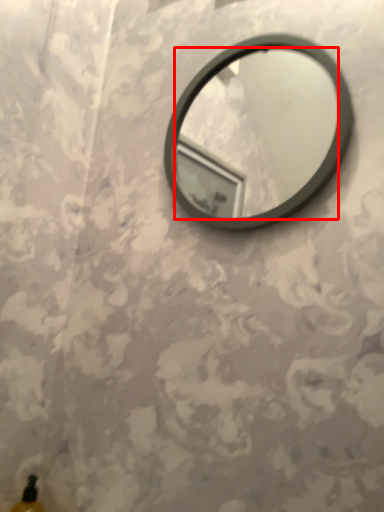
Question: Considering the relative positions of mirror (annotated by the red box) and bottle in the image provided, where is mirror (annotated by the red box) located with respect to the staircase?

Choices:
 (A) left
 (B) right

Answer: (B)